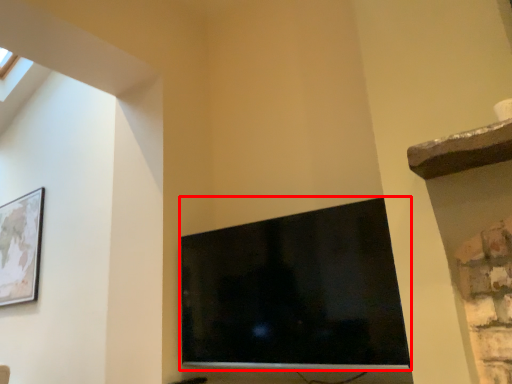
Question: From the image, what is the correct spatial relationship of television (annotated by the red box) in relation to picture frame?

Choices:
 (A) right
 (B) left

Answer: (A)